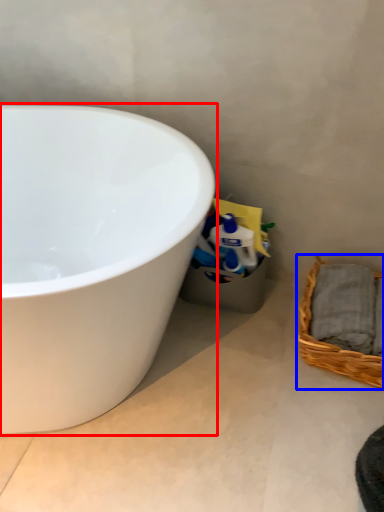
Question: Which object is closer to the camera taking this photo, bathtub (highlighted by a red box) or picnic basket (highlighted by a blue box)?

Choices:
 (A) bathtub
 (B) picnic basket

Answer: (A)